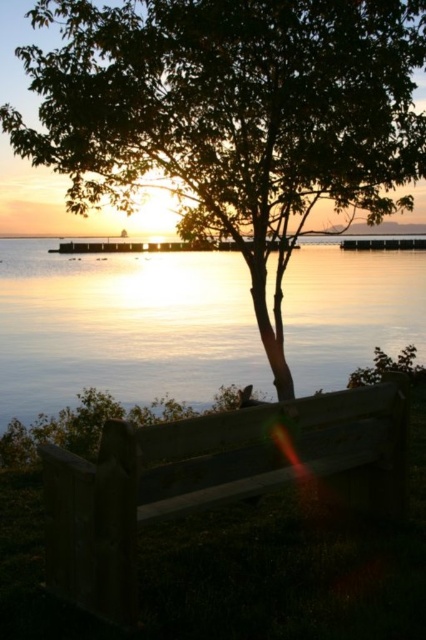
Does point (379, 38) come closer to viewer compared to point (337, 269)?

Yes, point (379, 38) is closer to viewer.

Is point (112, 168) closer to viewer compared to point (336, 276)?

Yes, point (112, 168) is in front of point (336, 276).

The image size is (426, 640). I want to click on green leafy tree at center, so click(x=230, y=115).

Is glistening silver water at center positioned before wooden bench at center?

No, it is behind wooden bench at center.

This screenshot has height=640, width=426. In order to click on glistening silver water at center in this screenshot , I will do `click(121, 326)`.

Identify the location of glistening silver water at center. (121, 326).

Is point (81, 152) more distant than point (94, 472)?

Yes, it is.

Does green leafy tree at center come in front of wooden bench at center?

No.

Who is more distant from viewer, (302, 17) or (54, 451)?

The point (302, 17) is more distant.

The width and height of the screenshot is (426, 640). Find the location of `green leafy tree at center`. green leafy tree at center is located at coordinates (230, 115).